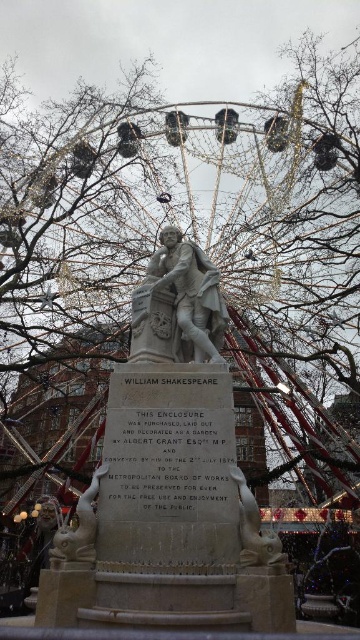
Question: Is white marble statue at center closer to camera compared to white stone lion at lower center?

Choices:
 (A) yes
 (B) no

Answer: (B)

Question: Can you confirm if bare branches at center is smaller than white stone lion at lower center?

Choices:
 (A) yes
 (B) no

Answer: (B)

Question: Which object is positioned closest to the white marble lion at lower left?

Choices:
 (A) white stone lion at lower center
 (B) white marble statue at center

Answer: (A)

Question: Which is nearer to the white marble statue at center?

Choices:
 (A) white stone lion at lower center
 (B) bare branches at center
 (C) white marble lion at lower left

Answer: (A)

Question: Which point is farther to the camera?

Choices:
 (A) white marble lion at lower left
 (B) white stone lion at lower center
 (C) bare branches at center
 (D) white marble statue at center

Answer: (C)

Question: Is bare branches at center closer to the viewer compared to white marble lion at lower left?

Choices:
 (A) no
 (B) yes

Answer: (A)